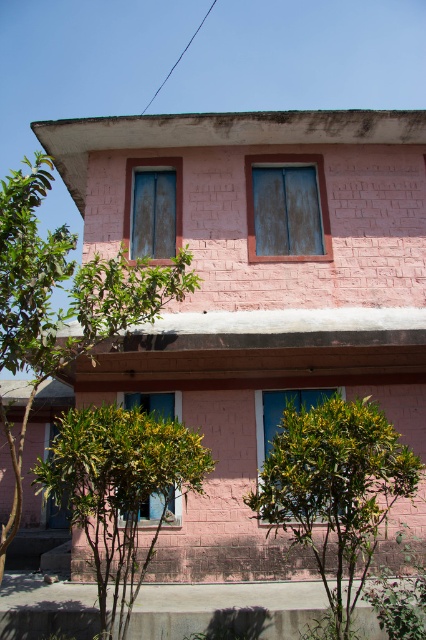
Can you confirm if blue painted wood window at left is positioned to the right of blue glass window at center?

In fact, blue painted wood window at left is to the left of blue glass window at center.

Who is taller, blue painted wood window at left or blue glass window at center?

blue painted wood window at left is taller.

Is point (143, 218) more distant than point (328, 390)?

Yes, it is.

Locate an element on the screen. blue painted wood window at left is located at coordinates (154, 205).

Does point (270, 218) come closer to viewer compared to point (141, 202)?

Yes, point (270, 218) is closer to viewer.

Is point (307, 256) positioned in front of point (172, 170)?

That is True.

Where is `blue matte window at center`? The height and width of the screenshot is (640, 426). blue matte window at center is located at coordinates (287, 209).

Can you confirm if green leafy bush at lower center is thinner than blue matte window at center?

Incorrect, green leafy bush at lower center's width is not less than blue matte window at center's.

Who is more distant from viewer, (385, 468) or (319, 177)?

The point (319, 177) is more distant.

Does point (296, 445) come closer to viewer compared to point (301, 180)?

Yes, it is.

Identify the location of green leafy bush at lower center. The width and height of the screenshot is (426, 640). (334, 490).